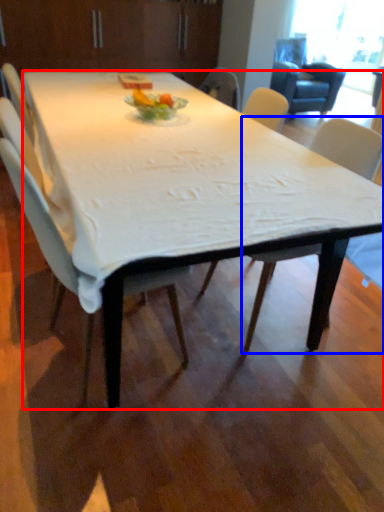
Question: Which object is further to the camera taking this photo, desk (highlighted by a red box) or chair (highlighted by a blue box)?

Choices:
 (A) desk
 (B) chair

Answer: (B)